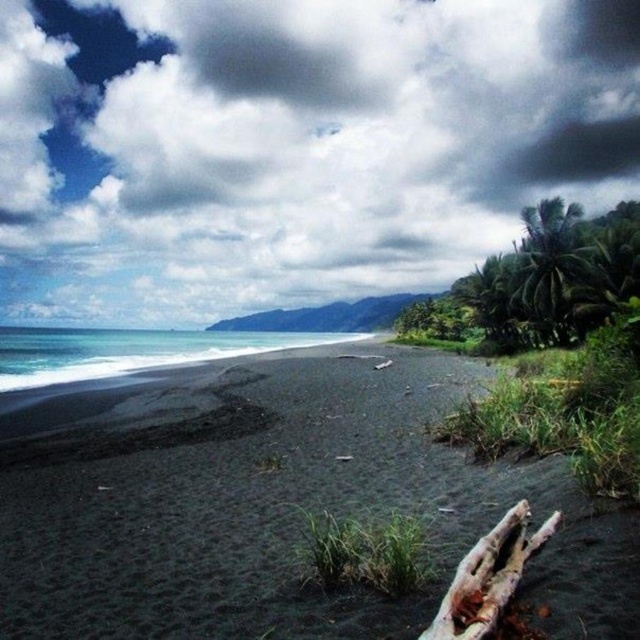
Can you confirm if cloudy sky at upper center is positioned below brown wood log at lower right?

No, cloudy sky at upper center is not below brown wood log at lower right.

Who is positioned more to the right, cloudy sky at upper center or brown wood log at lower right?

brown wood log at lower right

Measure the distance between point (92, 184) and camera.

They are 247.05 meters apart.

The height and width of the screenshot is (640, 640). Identify the location of cloudy sky at upper center. (292, 145).

Is point (36, 188) positioned behind point (381, 445)?

That is True.

Measure the distance between point (394, 257) and camera.

Point (394, 257) and camera are 219.51 meters apart.

This screenshot has height=640, width=640. I want to click on cloudy sky at upper center, so pyautogui.click(x=292, y=145).

I want to click on cloudy sky at upper center, so click(292, 145).

Between point (273, 612) and point (497, 572), which one is positioned in front?

Point (497, 572)

Can you confirm if black sand beach at center is positioned below brown wood log at lower right?

Yes, black sand beach at center is below brown wood log at lower right.

Does point (243, 436) come behind point (438, 612)?

Yes.

At what (x,y) coordinates should I click in order to perform the action: click on black sand beach at center. Please return your answer as a coordinate pair (x, y). Looking at the image, I should click on (285, 509).